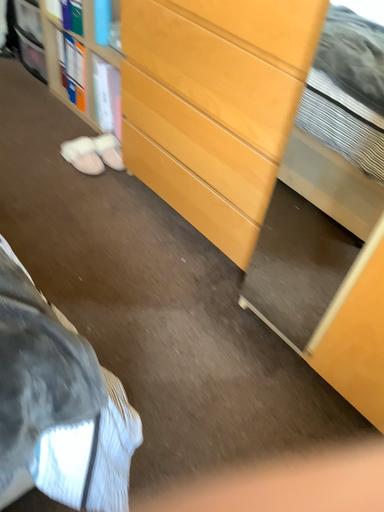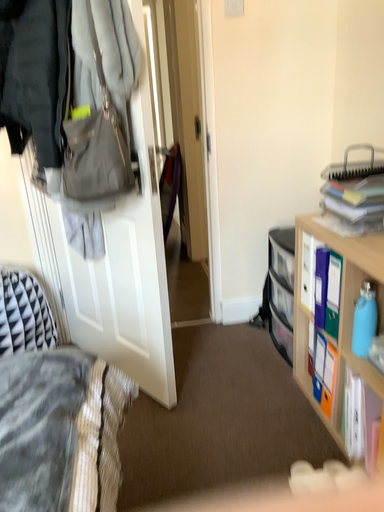
Question: How did the camera likely rotate when shooting the video?

Choices:
 (A) rotated upward
 (B) rotated downward

Answer: (A)